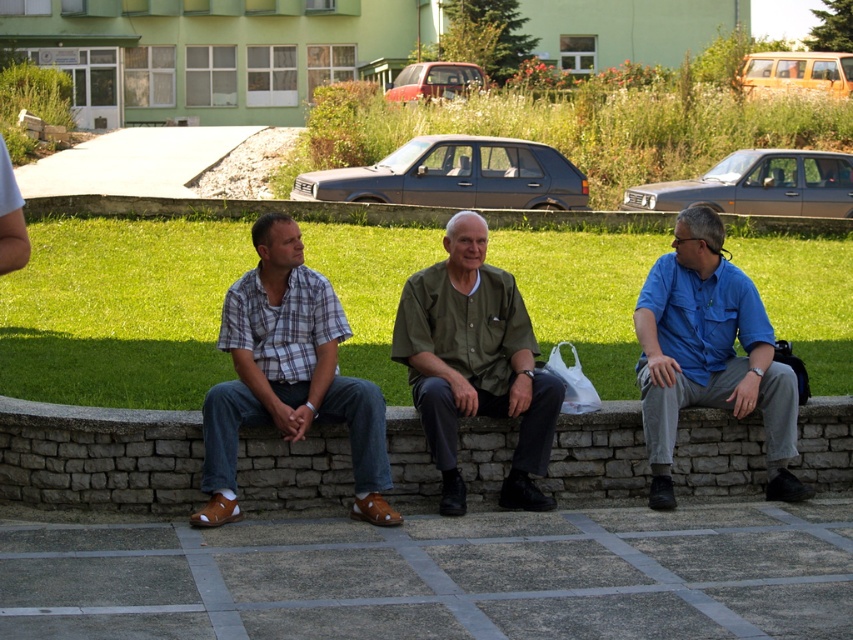
Question: Does plaid cotton shirt at center have a smaller size compared to green matte shirt at center?

Choices:
 (A) no
 (B) yes

Answer: (A)

Question: Estimate the real-world distances between objects in this image. Which object is farther from the blue cotton shirt at right?

Choices:
 (A) plaid cotton shirt at center
 (B) green matte shirt at center
 (C) stone bench at center

Answer: (C)

Question: Which object is positioned farthest from the plaid cotton shirt at center?

Choices:
 (A) blue cotton shirt at right
 (B) green matte shirt at center
 (C) stone bench at center

Answer: (A)

Question: Can you confirm if plaid cotton shirt at center is positioned above blue cotton shirt at right?

Choices:
 (A) yes
 (B) no

Answer: (B)

Question: Does stone bench at center appear on the left side of blue cotton shirt at right?

Choices:
 (A) yes
 (B) no

Answer: (A)

Question: Which of the following is the farthest from the observer?

Choices:
 (A) stone bench at center
 (B) plaid cotton shirt at center

Answer: (A)